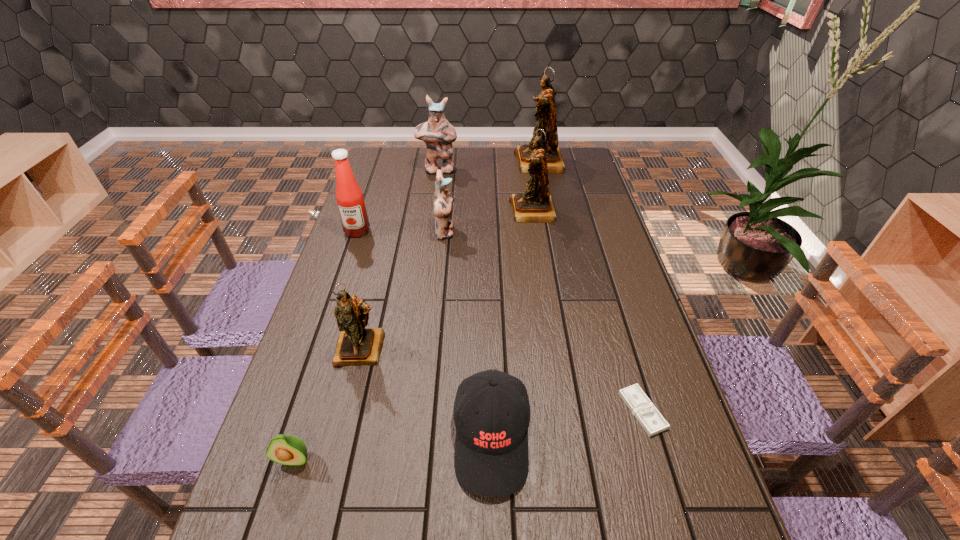
This screenshot has width=960, height=540. Identify the location of free space between the green avocado and the second nearest gold figurine. (413, 335).

I want to click on free space between the leftmost gold figurine and the red condiment, so click(359, 290).

Where is `vacant space that is in between the leftmost gold figurine and the farthest gold figurine`? The image size is (960, 540). vacant space that is in between the leftmost gold figurine and the farthest gold figurine is located at coordinates (450, 255).

Where is `vacant area that lies between the black baseball cap and the red condiment`? vacant area that lies between the black baseball cap and the red condiment is located at coordinates (424, 335).

Locate an element on the screen. This screenshot has width=960, height=540. free space between the second farthest gold figurine and the avocado is located at coordinates (413, 335).

The width and height of the screenshot is (960, 540). What are the coordinates of `vacant area between the farther pink figurine and the second biggest gold figurine` in the screenshot? It's located at (486, 191).

The height and width of the screenshot is (540, 960). In order to click on free space between the bigger pink figurine and the money in this screenshot , I will do `click(540, 291)`.

Find the location of a particular element. empty space between the second smallest gold figurine and the nearest figurine is located at coordinates (447, 280).

Identify which object is located as the sixth nearest to the money. Please provide its 2D coordinates. Your answer should be formatted as a tuple, i.e. [(x, y)], where the tuple contains the x and y coordinates of a point satisfying the conditions above.

[(349, 197)]

Find the location of `object that is the closest to the second nearest gold figurine`. object that is the closest to the second nearest gold figurine is located at coordinates (546, 117).